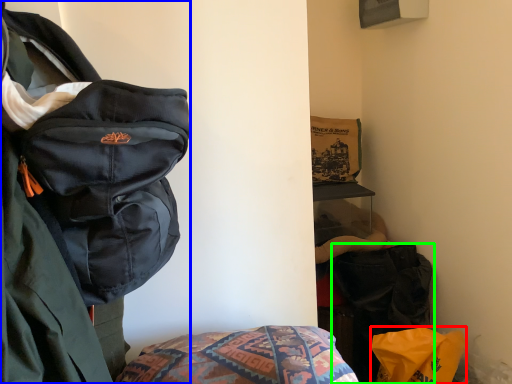
Question: Which object is positioned closest to material (highlighted by a red box)? Select from backpack (highlighted by a blue box) and luggage and bags (highlighted by a green box).

Choices:
 (A) backpack
 (B) luggage and bags

Answer: (B)